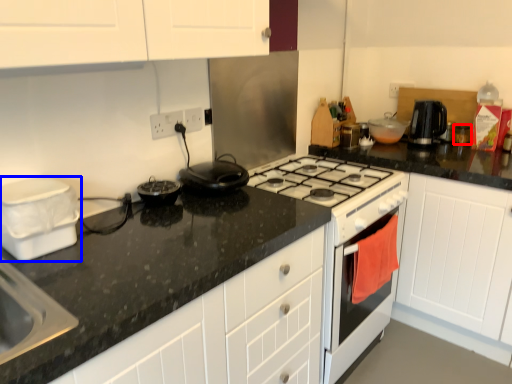
Question: Which object is further to the camera taking this photo, kitchen appliance (highlighted by a red box) or kitchen appliance (highlighted by a blue box)?

Choices:
 (A) kitchen appliance
 (B) kitchen appliance

Answer: (A)